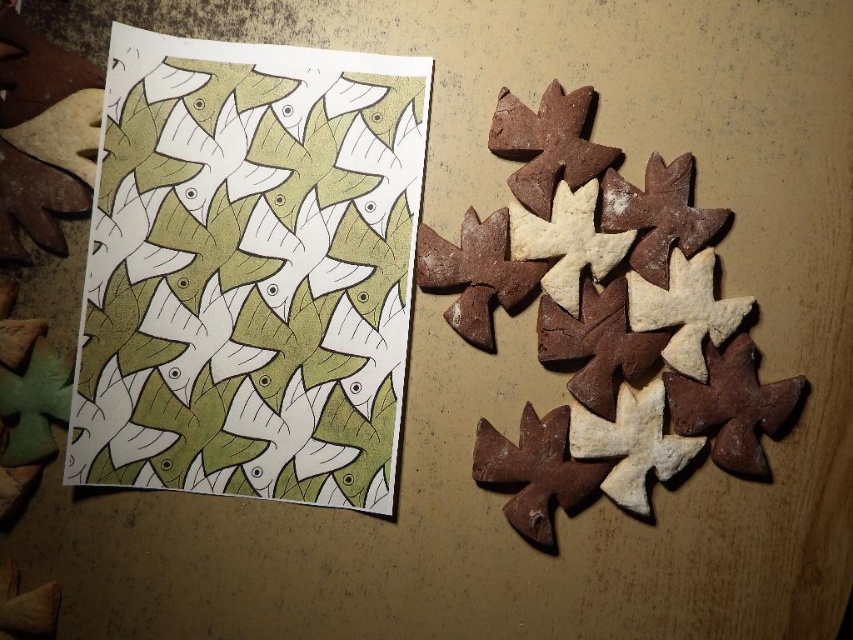
You are a baker who wants to place the brown crumbly gingerbread at right on top of the green paper at upper left. Can you fit it vertically without overlapping the edges?

The green paper at upper left is taller than the brown crumbly gingerbread at right, so yes, the gingerbread can be placed vertically on top of the green paper without overlapping the edges since the paper is taller.

You are a baker who wants to create a new leaf shape for your gingerbread cookies. You have the green paper at upper left and the brown crumbly gingerbread at right. Which material would be easier to cut into intricate shapes?

The green paper at upper left is thinner than the brown crumbly gingerbread at right, so the green paper at upper left would be easier to cut into intricate shapes.

You are an artist trying to create a leaf sculpture. You have the green paper at upper left and the brown crumbly gingerbread at right. Which material would you choose if you need something that takes up more space?

The brown crumbly gingerbread at right occupies more space than the green paper at upper left, so it would be the better choice for a sculpture needing more volume.